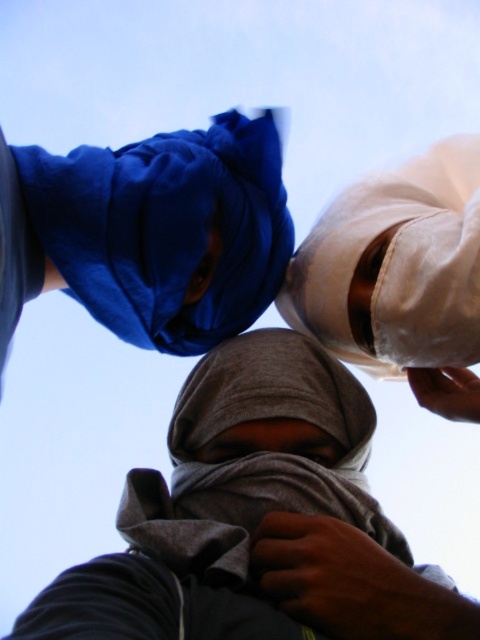
You are standing in front of the three individuals and want to reach the point closer to you. Which point should you aim for, point (272, 147) or point (143, 518)?

Point (272, 147) is closer to you than point (143, 518), so you should aim for point (272, 147).

Consider the image. You are a photographer standing below the three individuals. You want to capture a photo where both the blue fabric headscarf at upper center and the gray fabric headscarf at center are clearly visible. Given the distance between them, will you need to adjust your camera lens to a wider angle to ensure both fit in the frame?

The distance between the blue fabric headscarf at upper center and the gray fabric headscarf at center is 27.84 inches. To capture both in the same frame, a wider angle lens would be necessary to accommodate the space between them.

You are a photographer trying to capture a group photo of the blue fabric headscarf at upper center and the gray fabric headscarf at center. Based on their sizes, which one should you focus on to ensure both are in frame without cropping?

The blue fabric headscarf at upper center is smaller than the gray fabric headscarf at center, so focusing on the gray fabric headscarf at center would allow both to fit in the frame without cropping since it is larger and might require more space.